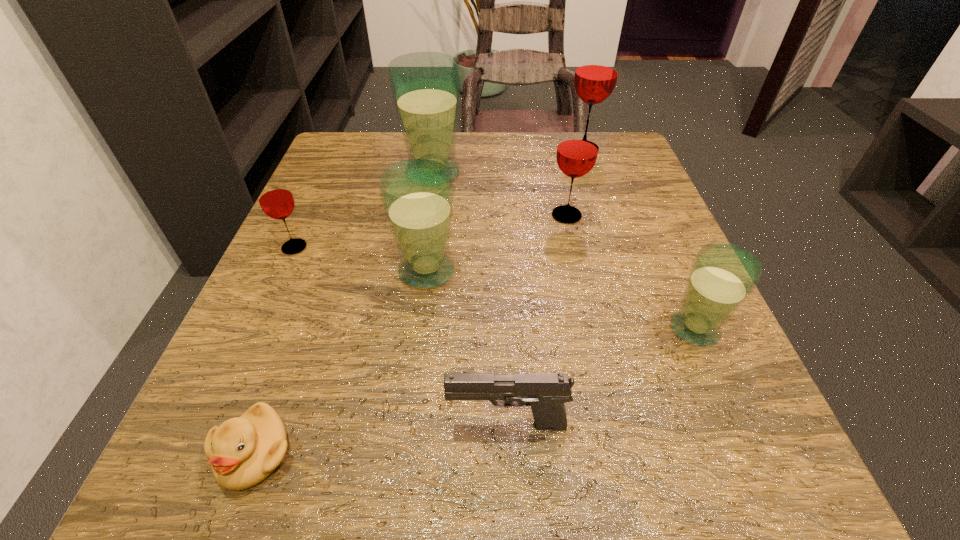
The width and height of the screenshot is (960, 540). Identify the location of vacant area that lies between the second nearest blue glass and the nearest red glass. (361, 259).

The image size is (960, 540). I want to click on vacant area that lies between the biggest blue glass and the second shortest object, so click(x=470, y=299).

Where is `vacant space in between the leftmost glass and the second smallest blue glass`? The width and height of the screenshot is (960, 540). vacant space in between the leftmost glass and the second smallest blue glass is located at coordinates (361, 259).

Find the location of a particular element. the fifth closest object to the biggest red glass is located at coordinates (275, 198).

Locate an element on the screen. The image size is (960, 540). object that is the seventh closest to the seventh tallest object is located at coordinates (596, 73).

Find the location of a particular element. The width and height of the screenshot is (960, 540). glass that stands as the second closest to the farthest red glass is located at coordinates (425, 86).

Find the location of `the second closest glass to the second biggest blue glass`. the second closest glass to the second biggest blue glass is located at coordinates (577, 151).

The width and height of the screenshot is (960, 540). Identify the location of the second closest red glass relative to the farthest red glass. (275, 198).

Select which red glass appears as the closest to the pistol. Please provide its 2D coordinates. Your answer should be formatted as a tuple, i.e. [(x, y)], where the tuple contains the x and y coordinates of a point satisfying the conditions above.

[(577, 151)]

In order to click on blue glass that is the closest to the farthest red glass in this screenshot , I will do `click(425, 86)`.